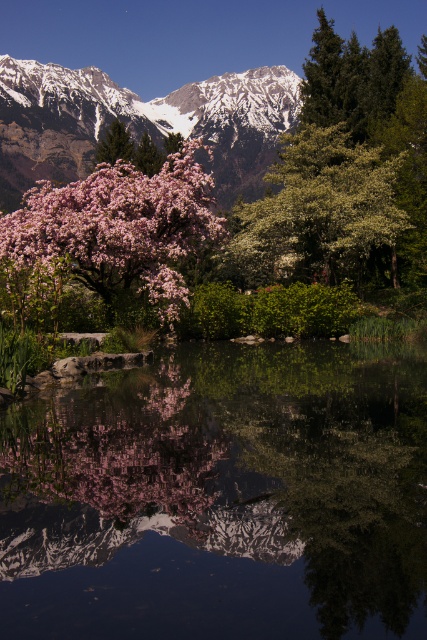
Based on the photo, you are standing in the landscape and want to take a photo of both the snowy rocky mountain range at upper left and the green leafy tree at center. Which object should you focus on first to ensure both are in the frame?

You should focus on the green leafy tree at center first because it is closer to you than the snowy rocky mountain range at upper left, so adjusting the camera to include the closer tree will also capture the distant mountains in the background.